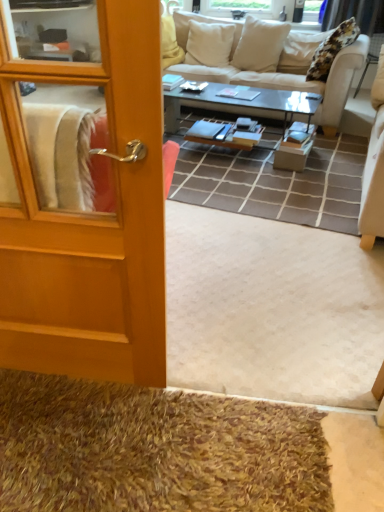
Question: Does beige fabric couch at upper center lie in front of shaggy brown doormat at lower left?

Choices:
 (A) no
 (B) yes

Answer: (A)

Question: From a real-world perspective, is beige fabric couch at upper center positioned under shaggy brown doormat at lower left based on gravity?

Choices:
 (A) no
 (B) yes

Answer: (A)

Question: Would you say beige fabric couch at upper center contains shaggy brown doormat at lower left?

Choices:
 (A) yes
 (B) no

Answer: (B)

Question: Is beige fabric couch at upper center to the left of shaggy brown doormat at lower left from the viewer's perspective?

Choices:
 (A) no
 (B) yes

Answer: (A)

Question: Is beige fabric couch at upper center next to shaggy brown doormat at lower left and touching it?

Choices:
 (A) no
 (B) yes

Answer: (A)

Question: Is the depth of beige fabric couch at upper center greater than that of shaggy brown doormat at lower left?

Choices:
 (A) yes
 (B) no

Answer: (A)

Question: Does black glass coffee table at center lie in front of beige fabric couch at upper center?

Choices:
 (A) yes
 (B) no

Answer: (A)

Question: From the image's perspective, is black glass coffee table at center over beige fabric couch at upper center?

Choices:
 (A) yes
 (B) no

Answer: (B)

Question: Is black glass coffee table at center smaller than beige fabric couch at upper center?

Choices:
 (A) yes
 (B) no

Answer: (A)

Question: Is black glass coffee table at center shorter than beige fabric couch at upper center?

Choices:
 (A) no
 (B) yes

Answer: (B)

Question: Is black glass coffee table at center aimed at beige fabric couch at upper center?

Choices:
 (A) no
 (B) yes

Answer: (B)

Question: Considering the relative sizes of black glass coffee table at center and beige fabric couch at upper center in the image provided, is black glass coffee table at center bigger than beige fabric couch at upper center?

Choices:
 (A) yes
 (B) no

Answer: (B)

Question: From a real-world perspective, is shaggy brown doormat at lower left beneath wooden door at left?

Choices:
 (A) no
 (B) yes

Answer: (B)